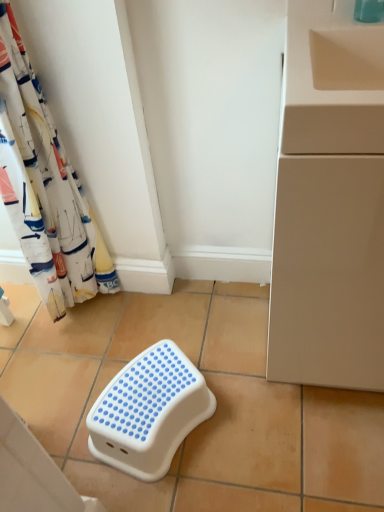
What do you see at coordinates (149, 412) in the screenshot? This screenshot has height=512, width=384. I see `white plastic step stool at center` at bounding box center [149, 412].

In order to face white plastic step stool at center, which is the 2th ceramic tile from left to right, should I rotate leftwards or rightwards?

To face it directly, rotate left by 3.730 degrees.

How much space does white plastic step stool at center, the first ceramic tile viewed from the right, occupy vertically?

The height of white plastic step stool at center, the first ceramic tile viewed from the right, is 1.29 inches.

What is the approximate height of beige ceramic tile at lower left, placed as the 1th ceramic tile when sorted from left to right?

It is 18.95 inches.

Locate an element on the screen. white plastic step stool at center is located at coordinates (149, 412).

I want to click on counter above the white plastic step stool at center, the first ceramic tile viewed from the right (from the image's perspective), so click(329, 203).

Considering the sizes of objects white plastic step stool at center, which is the 2th ceramic tile from left to right, and beige matte cabinet at right in the image provided, who is bigger, white plastic step stool at center, which is the 2th ceramic tile from left to right, or beige matte cabinet at right?

beige matte cabinet at right is bigger.

Which is closer, (279, 428) or (367, 50)?

Positioned in front is point (367, 50).

From the image's perspective, relative to beige matte cabinet at right, is white plastic step stool at center, which is the 2th ceramic tile from left to right, above or below?

From the image's perspective, white plastic step stool at center, which is the 2th ceramic tile from left to right, appears below beige matte cabinet at right.

Is point (19, 355) behind point (348, 335)?

That is True.

Who is more distant, beige ceramic tile at lower left, acting as the 2th ceramic tile starting from the right, or beige matte cabinet at right?

beige ceramic tile at lower left, acting as the 2th ceramic tile starting from the right, is more distant.

From the picture: Is beige ceramic tile at lower left, acting as the 2th ceramic tile starting from the right, looking in the opposite direction of beige matte cabinet at right?

No, beige ceramic tile at lower left, acting as the 2th ceramic tile starting from the right, is not facing away from beige matte cabinet at right.

Considering the relative sizes of beige ceramic tile at lower left, placed as the 1th ceramic tile when sorted from left to right, and beige matte cabinet at right in the image provided, is beige ceramic tile at lower left, placed as the 1th ceramic tile when sorted from left to right, taller than beige matte cabinet at right?

No, beige ceramic tile at lower left, placed as the 1th ceramic tile when sorted from left to right, is not taller than beige matte cabinet at right.

Does white plastic step stool at center, which is the 2th ceramic tile from left to right, have a larger size compared to white fabric curtain at left?

Yes.

Could you tell me if white plastic step stool at center, the first ceramic tile viewed from the right, is facing white fabric curtain at left?

No, white plastic step stool at center, the first ceramic tile viewed from the right, is not facing towards white fabric curtain at left.

Can you confirm if white plastic step stool at center, the first ceramic tile viewed from the right, is thinner than white fabric curtain at left?

Incorrect, the width of white plastic step stool at center, the first ceramic tile viewed from the right, is not less than that of white fabric curtain at left.

Considering the relative sizes of beige matte cabinet at right and white plastic step stool at center in the image provided, is beige matte cabinet at right thinner than white plastic step stool at center?

No.

Does beige matte cabinet at right have a smaller size compared to white plastic step stool at center?

Actually, beige matte cabinet at right might be larger than white plastic step stool at center.

Is beige matte cabinet at right inside or outside of white plastic step stool at center?

beige matte cabinet at right is not enclosed by white plastic step stool at center.

This screenshot has width=384, height=512. Find the location of `counter that is above the white plastic step stool at center (from the image's perspective)`. counter that is above the white plastic step stool at center (from the image's perspective) is located at coordinates (329, 203).

Is white fabric curtain at left taller than white plastic step stool at center, the first ceramic tile viewed from the right?

Correct, white fabric curtain at left is much taller as white plastic step stool at center, the first ceramic tile viewed from the right.

Which object is positioned more to the right, white fabric curtain at left or white plastic step stool at center, which is the 2th ceramic tile from left to right?

white plastic step stool at center, which is the 2th ceramic tile from left to right.

Can you confirm if white fabric curtain at left is thinner than white plastic step stool at center, which is the 2th ceramic tile from left to right?

Yes.

Considering the positions of points (4, 52) and (383, 458), is point (4, 52) farther from camera compared to point (383, 458)?

No, (4, 52) is in front of (383, 458).

In the scene shown: Does beige ceramic tile at lower left, placed as the 1th ceramic tile when sorted from left to right, contain white plastic step stool at center, which is the 2th ceramic tile from left to right?

No.

Based on the photo, is beige ceramic tile at lower left, placed as the 1th ceramic tile when sorted from left to right, positioned with its back to white plastic step stool at center, which is the 2th ceramic tile from left to right?

No, beige ceramic tile at lower left, placed as the 1th ceramic tile when sorted from left to right,'s orientation is not away from white plastic step stool at center, which is the 2th ceramic tile from left to right.

Is beige ceramic tile at lower left, acting as the 2th ceramic tile starting from the right, at the left side of white plastic step stool at center, which is the 2th ceramic tile from left to right?

Correct, you'll find beige ceramic tile at lower left, acting as the 2th ceramic tile starting from the right, to the left of white plastic step stool at center, which is the 2th ceramic tile from left to right.

Consider the image. Between beige ceramic tile at lower left, placed as the 1th ceramic tile when sorted from left to right, and white plastic step stool at center, the first ceramic tile viewed from the right, which one has larger size?

white plastic step stool at center, the first ceramic tile viewed from the right.

Is beige matte cabinet at right in contact with beige ceramic tile at lower left, acting as the 2th ceramic tile starting from the right?

No.

Which object is closer to the camera taking this photo, beige matte cabinet at right or beige ceramic tile at lower left, placed as the 1th ceramic tile when sorted from left to right?

beige matte cabinet at right.

Between beige matte cabinet at right and beige ceramic tile at lower left, placed as the 1th ceramic tile when sorted from left to right, which one appears on the left side from the viewer's perspective?

beige ceramic tile at lower left, placed as the 1th ceramic tile when sorted from left to right, is more to the left.

Does beige matte cabinet at right have a lesser height compared to beige ceramic tile at lower left, placed as the 1th ceramic tile when sorted from left to right?

No.

You are a GUI agent. You are given a task and a screenshot of the screen. Output one action in this format:
    pyautogui.click(x=<x>, y=<y>)
    Task: Click on the counter in front of the white plastic step stool at center, the first ceramic tile viewed from the right
    This screenshot has height=512, width=384.
    Given the screenshot: What is the action you would take?
    pyautogui.click(x=329, y=203)

The height and width of the screenshot is (512, 384). I want to click on the 1st ceramic tile directly beneath the beige matte cabinet at right (from a real-world perspective), so tap(49, 394).

When comparing their distances from beige ceramic tile at lower left, placed as the 1th ceramic tile when sorted from left to right, does white fabric curtain at left or white plastic step stool at center, which is the 2th ceramic tile from left to right, seem further?

Based on the image, white fabric curtain at left appears to be further to beige ceramic tile at lower left, placed as the 1th ceramic tile when sorted from left to right.

From the image, which object appears to be farther from beige ceramic tile at lower left, placed as the 1th ceramic tile when sorted from left to right, white plastic step stool at center, which is the 2th ceramic tile from left to right, or beige matte cabinet at right?

beige matte cabinet at right is positioned further to the anchor beige ceramic tile at lower left, placed as the 1th ceramic tile when sorted from left to right.

From the image, which object appears to be farther from beige ceramic tile at lower left, acting as the 2th ceramic tile starting from the right, beige matte cabinet at right or white plastic step stool at center?

The object further to beige ceramic tile at lower left, acting as the 2th ceramic tile starting from the right, is beige matte cabinet at right.

Looking at this image, which object lies further to the anchor point white plastic step stool at center, which is the 2th ceramic tile from left to right, white plastic step stool at center or beige ceramic tile at lower left, placed as the 1th ceramic tile when sorted from left to right?

beige ceramic tile at lower left, placed as the 1th ceramic tile when sorted from left to right, lies further to white plastic step stool at center, which is the 2th ceramic tile from left to right, than the other object.

Based on their spatial positions, is white plastic step stool at center or beige ceramic tile at lower left, placed as the 1th ceramic tile when sorted from left to right, closer to beige matte cabinet at right?

white plastic step stool at center is positioned closer to the anchor beige matte cabinet at right.

Estimate the real-world distances between objects in this image. Which object is further from white plastic step stool at center, the first ceramic tile viewed from the right, white plastic step stool at center or white fabric curtain at left?

white fabric curtain at left is positioned further to the anchor white plastic step stool at center, the first ceramic tile viewed from the right.

Looking at the image, which one is located further to beige ceramic tile at lower left, acting as the 2th ceramic tile starting from the right, beige matte cabinet at right or white plastic step stool at center, which is the 2th ceramic tile from left to right?

Based on the image, beige matte cabinet at right appears to be further to beige ceramic tile at lower left, acting as the 2th ceramic tile starting from the right.

Which object lies nearer to the anchor point white plastic step stool at center, white plastic step stool at center, the first ceramic tile viewed from the right, or beige ceramic tile at lower left, placed as the 1th ceramic tile when sorted from left to right?

white plastic step stool at center, the first ceramic tile viewed from the right, is positioned closer to the anchor white plastic step stool at center.

The height and width of the screenshot is (512, 384). I want to click on furniture between beige ceramic tile at lower left, placed as the 1th ceramic tile when sorted from left to right, and white plastic step stool at center, the first ceramic tile viewed from the right, from left to right, so 149,412.

The height and width of the screenshot is (512, 384). What are the coordinates of `furniture between beige ceramic tile at lower left, acting as the 2th ceramic tile starting from the right, and beige matte cabinet at right` in the screenshot? It's located at (149, 412).

This screenshot has height=512, width=384. I want to click on ceramic tile located between white plastic step stool at center and beige matte cabinet at right in the left-right direction, so click(x=204, y=422).

Where is `ceramic tile between white fabric curtain at left and white plastic step stool at center, the first ceramic tile viewed from the right, from top to bottom`? This screenshot has width=384, height=512. ceramic tile between white fabric curtain at left and white plastic step stool at center, the first ceramic tile viewed from the right, from top to bottom is located at coordinates (49, 394).